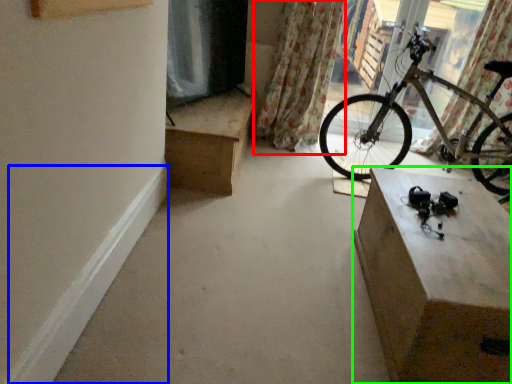
Question: Considering the real-world distances, which object is closest to curtain (highlighted by a red box)? curb (highlighted by a blue box) or cabinetry (highlighted by a green box).

Choices:
 (A) curb
 (B) cabinetry

Answer: (B)